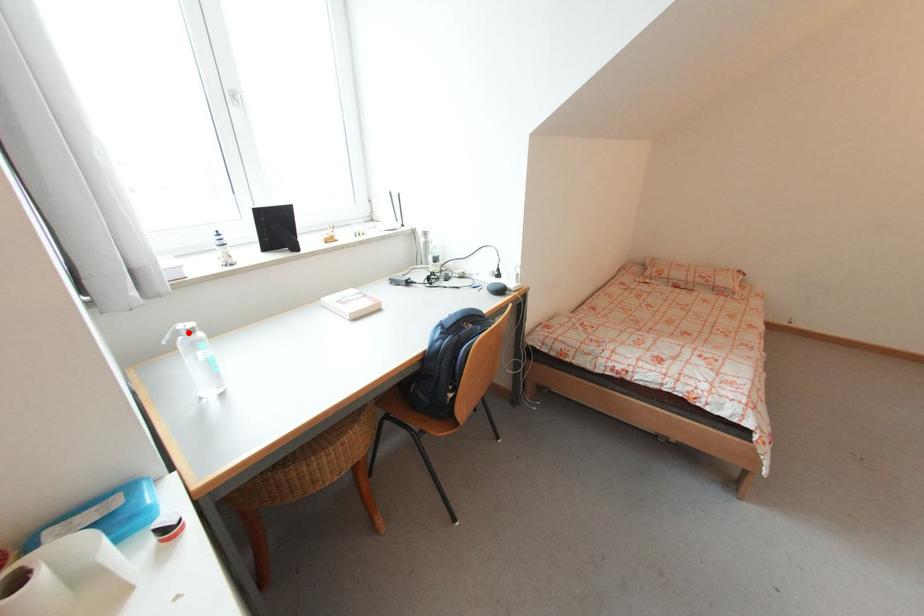
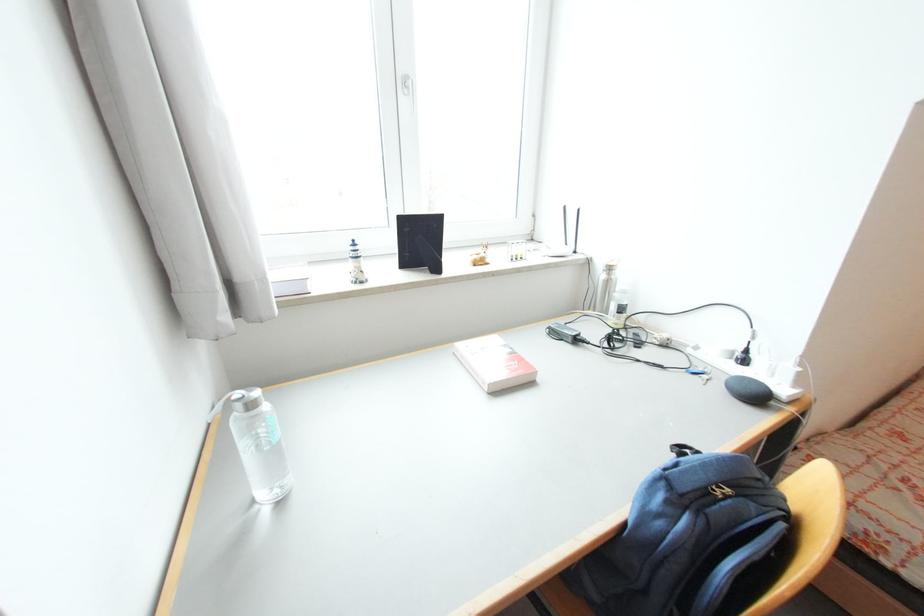
Locate, in the second image, the point that corresponds to the highlighted location in the first image.

(244, 407)